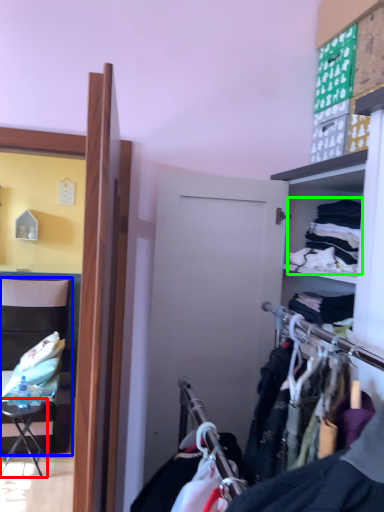
Question: Estimate the real-world distances between objects in this image. Which object is closer to table (highlighted by a red box), chair (highlighted by a blue box) or clothing (highlighted by a green box)?

Choices:
 (A) chair
 (B) clothing

Answer: (A)